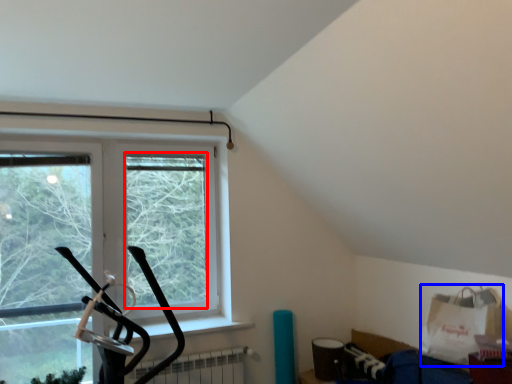
Question: Which object is closer to the camera taking this photo, window screen (highlighted by a red box) or grocery bag (highlighted by a blue box)?

Choices:
 (A) window screen
 (B) grocery bag

Answer: (B)